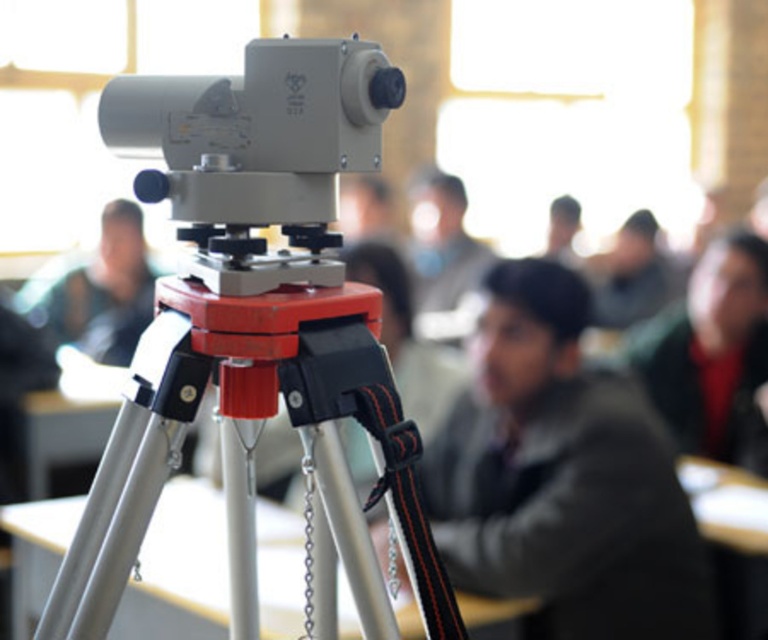
You are standing in the classroom and see the surveying instrument mounted on the tripod. There are two points marked in the image at coordinates point (414, 442) and point (113, 256). From your perspective, which point is closer to you?

Point (414, 442) is in front of point (113, 256), so it is closer to you.

You are a student sitting at the desk in the classroom. You notice the metallic tripod at center and the dark gray jacket at center. Which object is closer to you?

The metallic tripod at center is closer to you than the dark gray jacket at center.